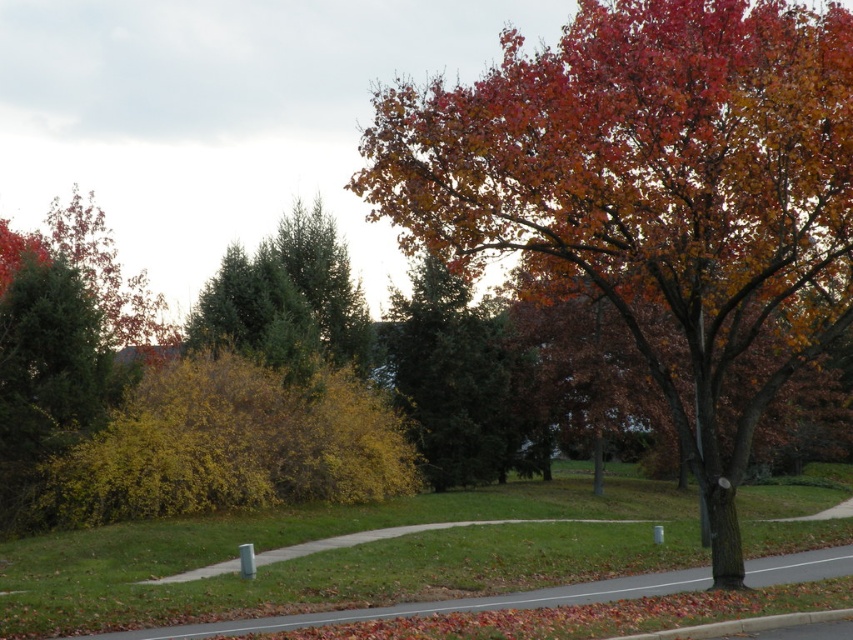
Between autumn leaves tree at center and green evergreen tree at center, which one is positioned higher?

autumn leaves tree at center

Looking at this image, between autumn leaves tree at center and green evergreen tree at center, which one is positioned lower?

green evergreen tree at center

Which is in front, point (432, 125) or point (244, 284)?

Positioned in front is point (432, 125).

Image resolution: width=853 pixels, height=640 pixels. Identify the location of autumn leaves tree at center. (654, 196).